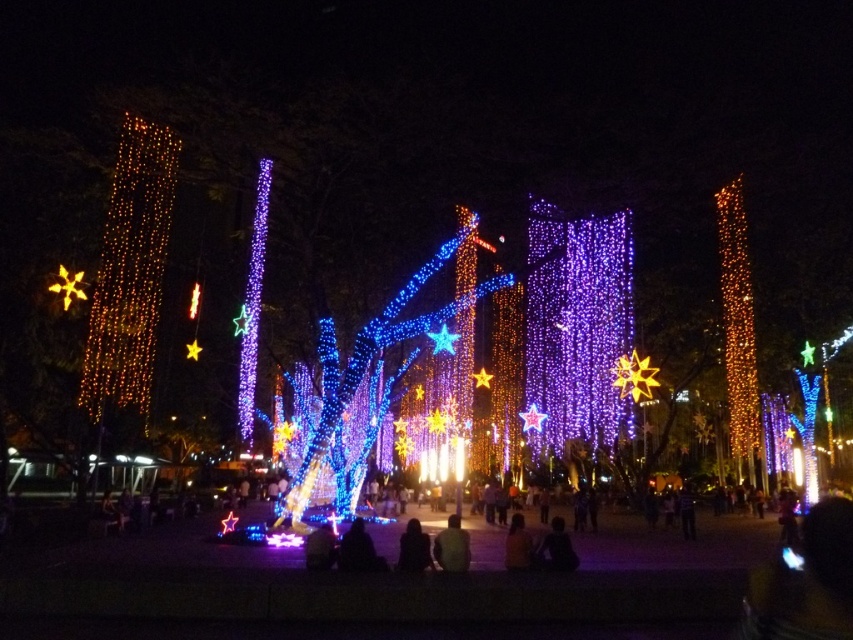
Question: Which object is farther from the camera taking this photo?

Choices:
 (A) dark brown leather jacket at center
 (B) black matte person at center

Answer: (A)

Question: Can you confirm if warm golden lights at left is thinner than dark blue fabric at center?

Choices:
 (A) no
 (B) yes

Answer: (A)

Question: Among these points, which one is nearest to the camera?

Choices:
 (A) (726, 289)
 (B) (115, 250)
 (C) (566, 536)

Answer: (C)

Question: Does orange string lights at right have a smaller size compared to dark fabric person at center?

Choices:
 (A) yes
 (B) no

Answer: (B)

Question: Is dark brown leather jacket at center thinner than black matte person at center?

Choices:
 (A) no
 (B) yes

Answer: (B)

Question: Which object is farther from the camera taking this photo?

Choices:
 (A) black matte person at lower center
 (B) dark fabric person at center

Answer: (A)